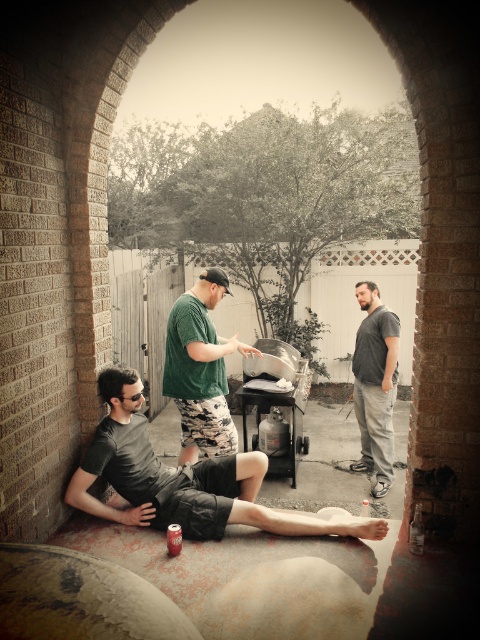
Question: Among these points, which one is farthest from the camera?

Choices:
 (A) (360, 323)
 (B) (139, 470)

Answer: (A)

Question: Considering the real-world distances, which object is farthest from the dark gray cotton shorts at lower left?

Choices:
 (A) green matte shirt at center
 (B) gray cotton t-shirt at center

Answer: (B)

Question: Does dark gray cotton shorts at lower left appear under green matte shirt at center?

Choices:
 (A) no
 (B) yes

Answer: (B)

Question: Is dark gray cotton shorts at lower left in front of gray cotton t-shirt at center?

Choices:
 (A) yes
 (B) no

Answer: (A)

Question: Which point is closer to the camera?

Choices:
 (A) dark gray cotton shorts at lower left
 (B) gray cotton t-shirt at center

Answer: (A)

Question: Is dark gray cotton shorts at lower left closer to the viewer compared to gray cotton t-shirt at center?

Choices:
 (A) no
 (B) yes

Answer: (B)